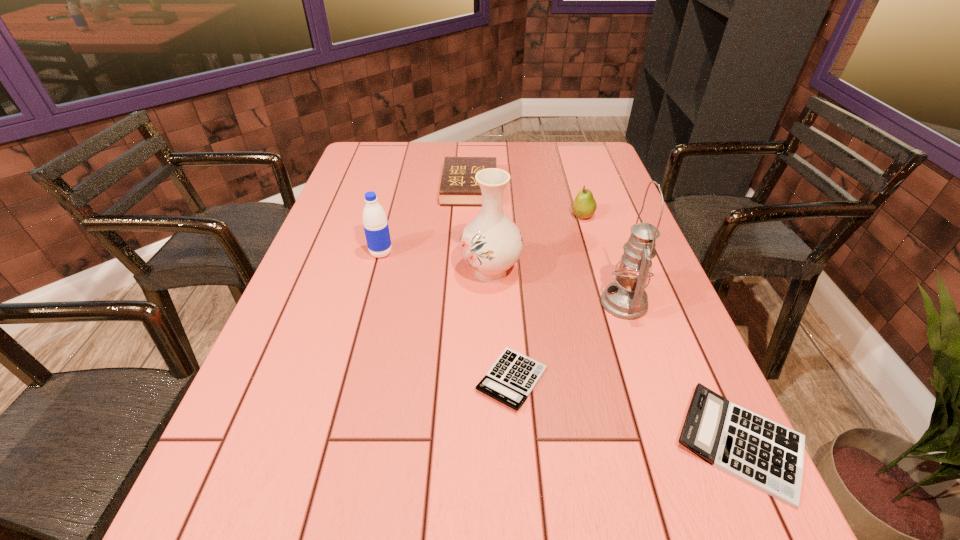
Please point a free position for a calculator on the left. Please provide its 2D coordinates. Your answer should be formatted as a tuple, i.e. [(x, y)], where the tuple contains the x and y coordinates of a point satisfying the conditions above.

[(330, 329)]